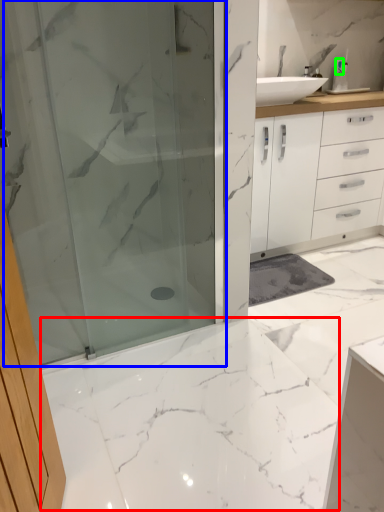
Question: Considering the real-world distances, which object is farthest from marble (highlighted by a red box)? shower door (highlighted by a blue box) or toiletry (highlighted by a green box)?

Choices:
 (A) shower door
 (B) toiletry

Answer: (B)